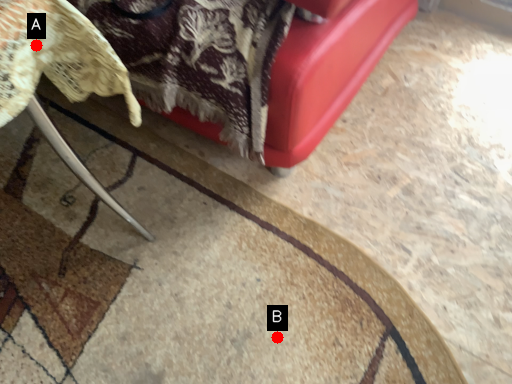
Question: Two points are circled on the image, labeled by A and B beside each circle. Among these points, which one is farthest from the camera?

Choices:
 (A) A is further
 (B) B is further

Answer: (B)